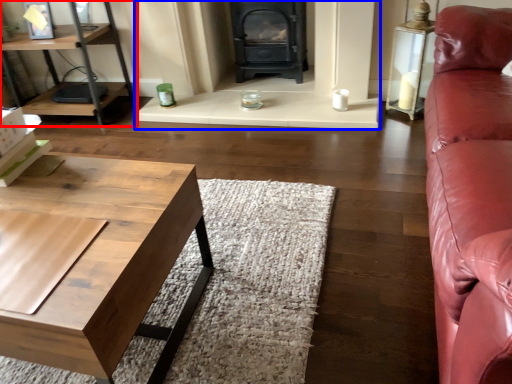
Question: Which object appears farthest to the camera in this image, shelf (highlighted by a red box) or fireplace (highlighted by a blue box)?

Choices:
 (A) shelf
 (B) fireplace

Answer: (A)